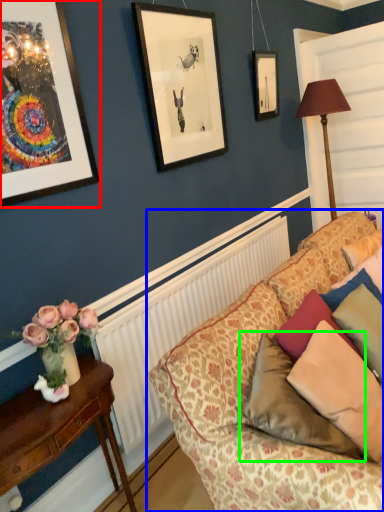
Question: Which object is the farthest from picture frame (highlighted by a red box)? Choose among these: studio couch (highlighted by a blue box) or pillow (highlighted by a green box).

Choices:
 (A) studio couch
 (B) pillow

Answer: (B)